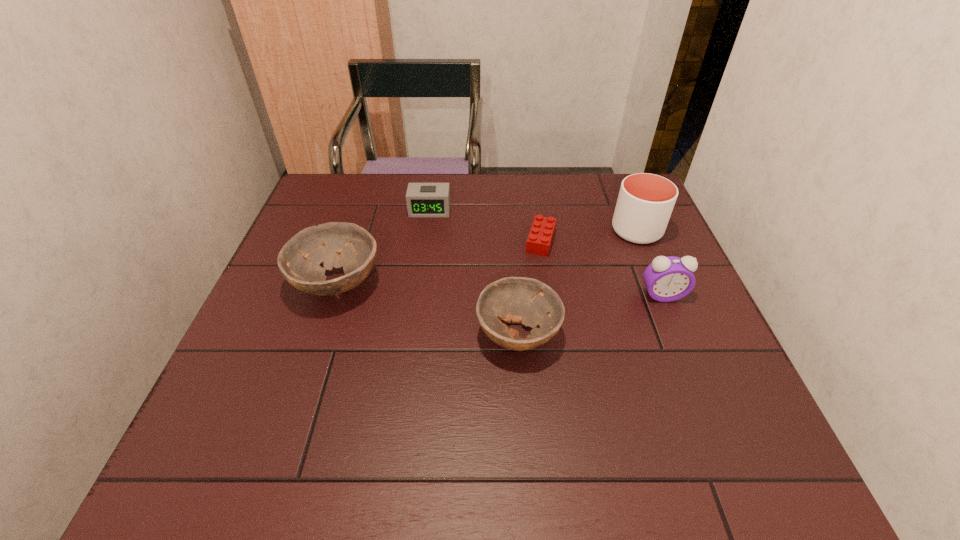
At what (x,y) coordinates should I click in order to perform the action: click on the taller bowl. Please return your answer as a coordinate pair (x, y). Looking at the image, I should click on click(299, 260).

Where is `the left bowl`? the left bowl is located at coordinates (299, 260).

Locate an element on the screen. This screenshot has width=960, height=540. the right bowl is located at coordinates (528, 301).

Locate an element on the screen. This screenshot has width=960, height=540. the shorter bowl is located at coordinates (528, 301).

I want to click on the shorter alarm clock, so click(x=424, y=200).

The height and width of the screenshot is (540, 960). Find the location of `the left alarm clock`. the left alarm clock is located at coordinates (424, 200).

The height and width of the screenshot is (540, 960). Identify the location of cup. (645, 202).

Where is `Lego`? This screenshot has height=540, width=960. Lego is located at coordinates (539, 241).

At what (x,y) coordinates should I click in order to perform the action: click on the taller alarm clock. Please return your answer as a coordinate pair (x, y). The width and height of the screenshot is (960, 540). Looking at the image, I should click on (667, 279).

Where is `the right alarm clock`? the right alarm clock is located at coordinates (667, 279).